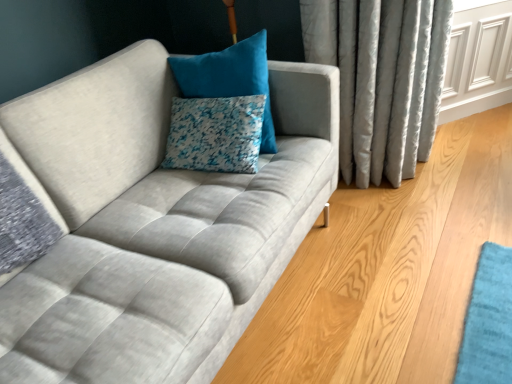
Question: Is white textured pillow at center, acting as the 2th pillow starting from the top, positioned far away from velvet blue pillow at upper center, which is the 1th pillow in top-to-bottom order?

Choices:
 (A) yes
 (B) no

Answer: (B)

Question: From a real-world perspective, is white textured pillow at center, acting as the 2th pillow starting from the top, on top of velvet blue pillow at upper center, which is the second pillow in bottom-to-top order?

Choices:
 (A) yes
 (B) no

Answer: (B)

Question: From the image's perspective, does white textured pillow at center, acting as the 2th pillow starting from the top, appear lower than velvet blue pillow at upper center, which is the second pillow in bottom-to-top order?

Choices:
 (A) yes
 (B) no

Answer: (A)

Question: Does white textured pillow at center, which is counted as the 1th pillow, starting from the bottom, contain velvet blue pillow at upper center, which is the second pillow in bottom-to-top order?

Choices:
 (A) no
 (B) yes

Answer: (A)

Question: Can you confirm if white textured pillow at center, acting as the 2th pillow starting from the top, is wider than velvet blue pillow at upper center, which is the second pillow in bottom-to-top order?

Choices:
 (A) yes
 (B) no

Answer: (B)

Question: Considering the relative positions of white textured pillow at center, acting as the 2th pillow starting from the top, and velvet blue pillow at upper center, which is the second pillow in bottom-to-top order, in the image provided, is white textured pillow at center, acting as the 2th pillow starting from the top, to the right of velvet blue pillow at upper center, which is the second pillow in bottom-to-top order, from the viewer's perspective?

Choices:
 (A) yes
 (B) no

Answer: (B)

Question: Is velvet blue pillow at upper center, which is the 1th pillow in top-to-bottom order, not inside white textured pillow at center, acting as the 2th pillow starting from the top?

Choices:
 (A) yes
 (B) no

Answer: (A)

Question: Is velvet blue pillow at upper center, which is the 1th pillow in top-to-bottom order, thinner than white textured pillow at center, which is counted as the 1th pillow, starting from the bottom?

Choices:
 (A) no
 (B) yes

Answer: (A)

Question: From the image's perspective, does velvet blue pillow at upper center, which is the 1th pillow in top-to-bottom order, appear lower than white textured pillow at center, acting as the 2th pillow starting from the top?

Choices:
 (A) no
 (B) yes

Answer: (A)

Question: Can you confirm if velvet blue pillow at upper center, which is the 1th pillow in top-to-bottom order, is bigger than white textured pillow at center, acting as the 2th pillow starting from the top?

Choices:
 (A) no
 (B) yes

Answer: (B)

Question: From the image's perspective, is velvet blue pillow at upper center, which is the second pillow in bottom-to-top order, on top of white textured pillow at center, which is counted as the 1th pillow, starting from the bottom?

Choices:
 (A) no
 (B) yes

Answer: (B)

Question: Is velvet blue pillow at upper center, which is the 1th pillow in top-to-bottom order, positioned before white textured pillow at center, which is counted as the 1th pillow, starting from the bottom?

Choices:
 (A) yes
 (B) no

Answer: (A)

Question: Is white textured pillow at center, acting as the 2th pillow starting from the top, situated inside velvet blue pillow at upper center, which is the second pillow in bottom-to-top order, or outside?

Choices:
 (A) outside
 (B) inside

Answer: (A)